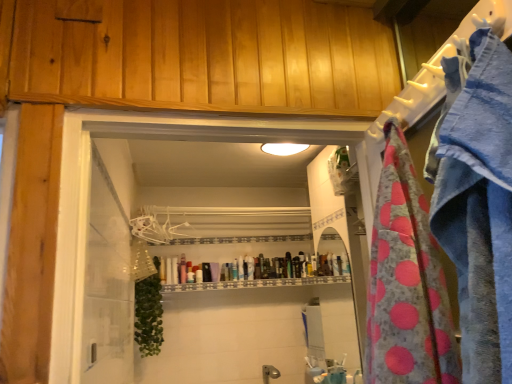
Question: Is translucent plastic tube at center facing towards white plastic hanger at upper center?

Choices:
 (A) no
 (B) yes

Answer: (A)

Question: Could white plastic hanger at upper center be considered to be inside translucent plastic tube at center?

Choices:
 (A) no
 (B) yes

Answer: (A)

Question: Considering the relative positions of translucent plastic tube at center and white plastic hanger at upper center in the image provided, is translucent plastic tube at center in front of white plastic hanger at upper center?

Choices:
 (A) yes
 (B) no

Answer: (B)

Question: Considering the relative positions of translucent plastic tube at center and white plastic hanger at upper center in the image provided, is translucent plastic tube at center to the left of white plastic hanger at upper center from the viewer's perspective?

Choices:
 (A) no
 (B) yes

Answer: (A)

Question: Is translucent plastic tube at center thinner than white plastic hanger at upper center?

Choices:
 (A) yes
 (B) no

Answer: (B)

Question: Are translucent plastic tube at center and white plastic hanger at upper center far apart?

Choices:
 (A) yes
 (B) no

Answer: (B)

Question: Is white plastic hanger at upper center in contact with pink polka dot fabric at right?

Choices:
 (A) no
 (B) yes

Answer: (A)

Question: Is white plastic hanger at upper center outside of pink polka dot fabric at right?

Choices:
 (A) no
 (B) yes

Answer: (B)

Question: From a real-world perspective, is white plastic hanger at upper center positioned under pink polka dot fabric at right based on gravity?

Choices:
 (A) no
 (B) yes

Answer: (A)

Question: Does white plastic hanger at upper center turn towards pink polka dot fabric at right?

Choices:
 (A) no
 (B) yes

Answer: (A)

Question: Does white plastic hanger at upper center have a lesser height compared to pink polka dot fabric at right?

Choices:
 (A) no
 (B) yes

Answer: (B)

Question: Is the depth of white plastic hanger at upper center less than that of pink polka dot fabric at right?

Choices:
 (A) no
 (B) yes

Answer: (A)

Question: Does white plastic hanger at upper center turn towards translucent plastic tube at center?

Choices:
 (A) yes
 (B) no

Answer: (B)